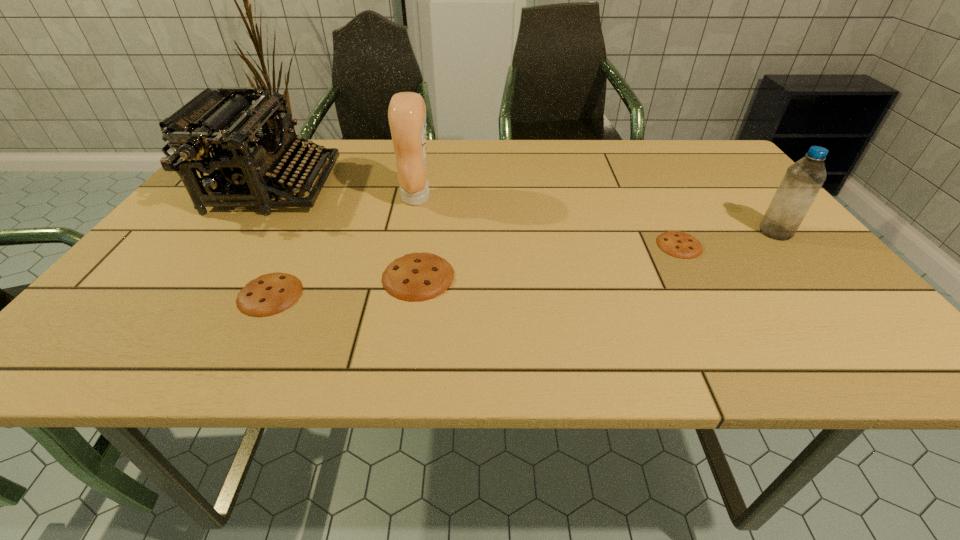
This screenshot has height=540, width=960. Identify the location of vacant area that lies between the condiment and the shortest object. (548, 221).

This screenshot has height=540, width=960. I want to click on vacant area that lies between the tallest cookie and the rightmost object, so click(x=597, y=254).

Locate an element on the screen. This screenshot has width=960, height=540. free space between the second cookie from right to left and the rightmost cookie is located at coordinates (549, 261).

Find the location of a particular element. The image size is (960, 540). the fourth closest object to the second shortest cookie is located at coordinates (675, 243).

Identify which object is the closest to the second shortest cookie. Please provide its 2D coordinates. Your answer should be formatted as a tuple, i.e. [(x, y)], where the tuple contains the x and y coordinates of a point satisfying the conditions above.

[(416, 276)]

Where is `cookie that is the second closest one to the second cookie from right to left`? The image size is (960, 540). cookie that is the second closest one to the second cookie from right to left is located at coordinates (675, 243).

Where is `the closest cookie to the typewriter`? the closest cookie to the typewriter is located at coordinates (271, 293).

Locate an element on the screen. This screenshot has width=960, height=540. free spot that satisfies the following two spatial constraints: 1. on the back side of the rightmost cookie; 2. on the right side of the rightmost object is located at coordinates (672, 232).

Find the location of a particular element. This screenshot has width=960, height=540. blank space that satisfies the following two spatial constraints: 1. on the back side of the tallest cookie; 2. on the left side of the leftmost cookie is located at coordinates (279, 276).

You are a GUI agent. You are given a task and a screenshot of the screen. Output one action in this format:
    pyautogui.click(x=<x>, y=<y>)
    Task: Click on the vacant area that satisfies the following two spatial constraints: 1. on the typing side of the typewriter; 2. on the left side of the second object from right to left
    The width and height of the screenshot is (960, 540).
    Given the screenshot: What is the action you would take?
    pyautogui.click(x=235, y=245)